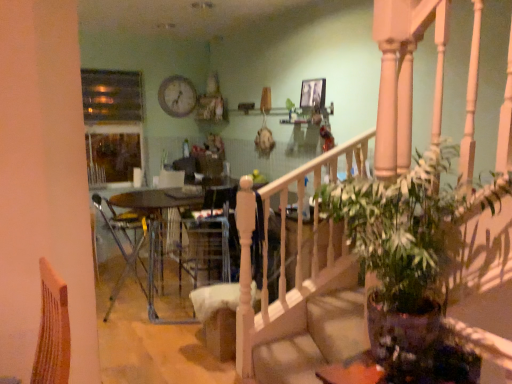
Question: From the image's perspective, is metallic silver chair at center above green glossy houseplant at lower right?

Choices:
 (A) yes
 (B) no

Answer: (B)

Question: Is metallic silver chair at center completely or partially outside of green glossy houseplant at lower right?

Choices:
 (A) yes
 (B) no

Answer: (A)

Question: Is metallic silver chair at center to the left of green glossy houseplant at lower right from the viewer's perspective?

Choices:
 (A) no
 (B) yes

Answer: (B)

Question: Considering the relative sizes of metallic silver chair at center and green glossy houseplant at lower right in the image provided, is metallic silver chair at center shorter than green glossy houseplant at lower right?

Choices:
 (A) yes
 (B) no

Answer: (B)

Question: Is metallic silver chair at center at the right side of green glossy houseplant at lower right?

Choices:
 (A) yes
 (B) no

Answer: (B)

Question: Is metallic silver chair at center taller or shorter than wooden clock at upper center?

Choices:
 (A) tall
 (B) short

Answer: (A)

Question: From the image's perspective, is metallic silver chair at center positioned above or below wooden clock at upper center?

Choices:
 (A) above
 (B) below

Answer: (B)

Question: Is point (109, 205) positioned closer to the camera than point (161, 94)?

Choices:
 (A) farther
 (B) closer

Answer: (B)

Question: Would you say metallic silver chair at center is inside or outside wooden clock at upper center?

Choices:
 (A) outside
 (B) inside

Answer: (A)

Question: From the image's perspective, is metallic silver chair at center located above or below velvet beige armchair at center?

Choices:
 (A) below
 (B) above

Answer: (A)

Question: Considering the positions of metallic silver chair at center and velvet beige armchair at center in the image, is metallic silver chair at center taller or shorter than velvet beige armchair at center?

Choices:
 (A) tall
 (B) short

Answer: (B)

Question: From a real-world perspective, is metallic silver chair at center positioned above or below velvet beige armchair at center?

Choices:
 (A) above
 (B) below

Answer: (B)

Question: Looking at the image, does metallic silver chair at center seem bigger or smaller compared to velvet beige armchair at center?

Choices:
 (A) small
 (B) big

Answer: (A)

Question: From their relative heights in the image, would you say velvet beige armchair at center is taller or shorter than wooden clock at upper center?

Choices:
 (A) short
 (B) tall

Answer: (B)

Question: From a real-world perspective, is velvet beige armchair at center physically located above or below wooden clock at upper center?

Choices:
 (A) above
 (B) below

Answer: (B)